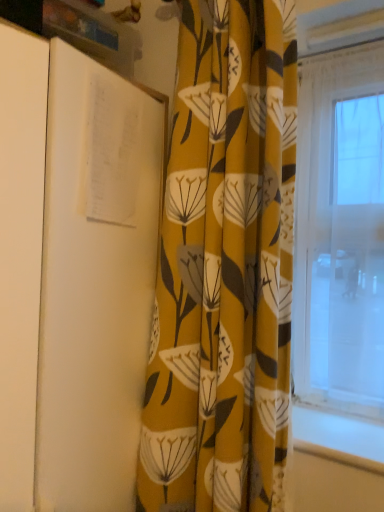
This screenshot has width=384, height=512. What do you see at coordinates (224, 267) in the screenshot?
I see `yellow floral fabric curtain at center` at bounding box center [224, 267].

Where is `yellow floral fabric curtain at center`? This screenshot has width=384, height=512. yellow floral fabric curtain at center is located at coordinates (224, 267).

What is the approximate width of yellow floral fabric curtain at center?

yellow floral fabric curtain at center is 5.99 inches wide.

Image resolution: width=384 pixels, height=512 pixels. What do you see at coordinates (95, 282) in the screenshot? I see `white paper at left` at bounding box center [95, 282].

Find the location of a particular element. The image size is (384, 512). white paper at left is located at coordinates (95, 282).

The width and height of the screenshot is (384, 512). I want to click on yellow floral fabric curtain at center, so click(224, 267).

Is white paper at left to the right of yellow floral fabric curtain at center from the viewer's perspective?

No.

Which object is more forward, white paper at left or yellow floral fabric curtain at center?

white paper at left is in front.

Is point (85, 402) farther from viewer compared to point (225, 228)?

No.

From the image's perspective, is white paper at left below yellow floral fabric curtain at center?

Indeed, from the image's perspective, white paper at left is shown beneath yellow floral fabric curtain at center.

From a real-world perspective, which is physically above, white paper at left or yellow floral fabric curtain at center?

In real-world perspective, yellow floral fabric curtain at center is above.

Looking at this image, does white paper at left have a greater width compared to yellow floral fabric curtain at center?

Correct, the width of white paper at left exceeds that of yellow floral fabric curtain at center.

Can you confirm if white paper at left is taller than yellow floral fabric curtain at center?

No.

Does white paper at left have a smaller size compared to yellow floral fabric curtain at center?

Actually, white paper at left might be larger than yellow floral fabric curtain at center.

Can yellow floral fabric curtain at center be found inside white paper at left?

No, yellow floral fabric curtain at center is not inside white paper at left.

Are white paper at left and yellow floral fabric curtain at center located far from each other?

No, there isn't a large distance between white paper at left and yellow floral fabric curtain at center.

Is white paper at left oriented away from yellow floral fabric curtain at center?

white paper at left is not turned away from yellow floral fabric curtain at center.

Measure the distance between white paper at left and yellow floral fabric curtain at center.

white paper at left is 7.78 inches away from yellow floral fabric curtain at center.

Identify the location of curtain above the white paper at left (from a real-world perspective). The width and height of the screenshot is (384, 512). (224, 267).

Can you confirm if yellow floral fabric curtain at center is positioned to the right of white paper at left?

Yes, yellow floral fabric curtain at center is to the right of white paper at left.

Considering the relative positions of yellow floral fabric curtain at center and white paper at left in the image provided, is yellow floral fabric curtain at center in front of white paper at left?

No, it is behind white paper at left.

Is point (216, 350) closer to viewer compared to point (128, 285)?

Yes, it is.

From the image's perspective, would you say yellow floral fabric curtain at center is shown under white paper at left?

No, from the image's perspective, yellow floral fabric curtain at center is not beneath white paper at left.

From a real-world perspective, is yellow floral fabric curtain at center located higher than white paper at left?

Yes, from a real-world perspective, yellow floral fabric curtain at center is over white paper at left

Between yellow floral fabric curtain at center and white paper at left, which one has smaller width?

yellow floral fabric curtain at center.

Is yellow floral fabric curtain at center taller than white paper at left?

Yes, yellow floral fabric curtain at center is taller than white paper at left.

Which of these two, yellow floral fabric curtain at center or white paper at left, is smaller?

yellow floral fabric curtain at center.

Is yellow floral fabric curtain at center located outside white paper at left?

yellow floral fabric curtain at center lies outside white paper at left's area.

Are yellow floral fabric curtain at center and white paper at left making contact?

yellow floral fabric curtain at center and white paper at left are clearly separated.

Does yellow floral fabric curtain at center turn towards white paper at left?

No, yellow floral fabric curtain at center is not turned towards white paper at left.

Measure the distance between yellow floral fabric curtain at center and white paper at left.

yellow floral fabric curtain at center and white paper at left are 7.78 inches apart.

There is a white paper at left. Identify the location of curtain above it (from a real-world perspective). (224, 267).

Locate an element on the screen. notebook to the left of yellow floral fabric curtain at center is located at coordinates (95, 282).

Find the location of a particular element. notebook that is under the yellow floral fabric curtain at center (from a real-world perspective) is located at coordinates (95, 282).